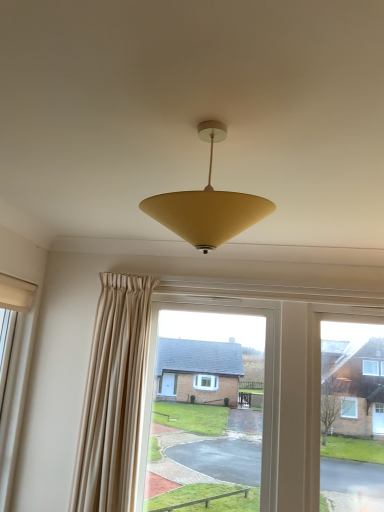
Question: From the image's perspective, is matte yellow cone at center located above or below white matte window at left?

Choices:
 (A) above
 (B) below

Answer: (A)

Question: In terms of width, does matte yellow cone at center look wider or thinner when compared to white matte window at left?

Choices:
 (A) wide
 (B) thin

Answer: (A)

Question: From a real-world perspective, is matte yellow cone at center positioned above or below white matte window at left?

Choices:
 (A) below
 (B) above

Answer: (B)

Question: Is white matte window at left wider or thinner than matte yellow cone at center?

Choices:
 (A) wide
 (B) thin

Answer: (B)

Question: Does point (11, 354) appear closer or farther from the camera than point (180, 205)?

Choices:
 (A) closer
 (B) farther

Answer: (B)

Question: In the image, is white matte window at left on the left side or the right side of matte yellow cone at center?

Choices:
 (A) right
 (B) left

Answer: (B)

Question: From a real-world perspective, is white matte window at left physically located above or below matte yellow cone at center?

Choices:
 (A) below
 (B) above

Answer: (A)